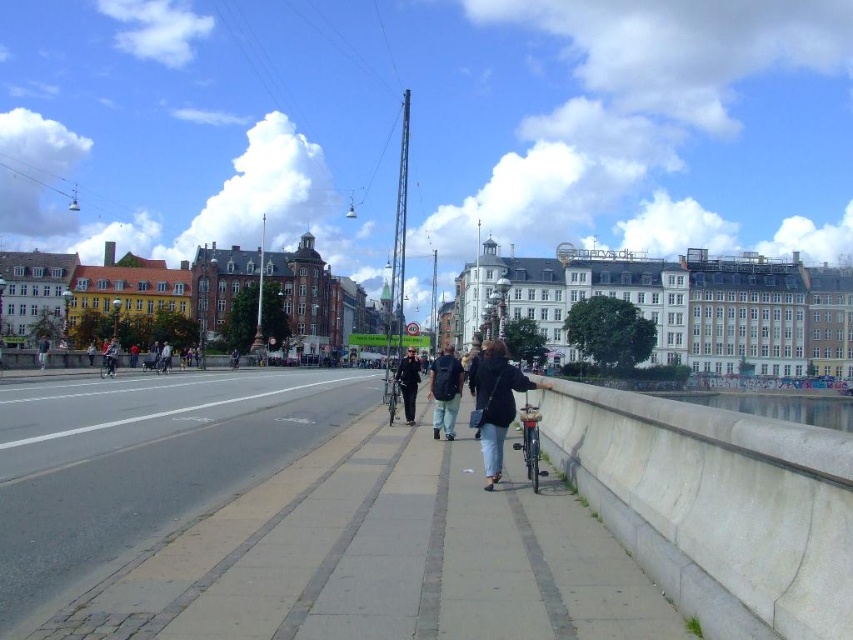
Is dark blue backpack at center below dark blue uniform at center?

Yes.

Which is in front, point (447, 372) or point (415, 362)?

Point (447, 372) is more forward.

Image resolution: width=853 pixels, height=640 pixels. In order to click on dark blue backpack at center in this screenshot , I will do `click(445, 392)`.

Where is `dark blue backpack at center`? dark blue backpack at center is located at coordinates (445, 392).

Is denim jacket at center closer to camera compared to gray concrete waterway at lower right?

Yes, it is in front of gray concrete waterway at lower right.

Is point (479, 365) less distant than point (728, 406)?

Yes, it is.

What do you see at coordinates (496, 404) in the screenshot? I see `denim jacket at center` at bounding box center [496, 404].

The height and width of the screenshot is (640, 853). In order to click on denim jacket at center in this screenshot , I will do `click(496, 404)`.

Is gray concrete pavement at center positioned at the back of denim jacket at center?

No.

Looking at this image, who is shorter, gray concrete pavement at center or denim jacket at center?

gray concrete pavement at center is shorter.

Locate an element on the screen. This screenshot has height=640, width=853. gray concrete pavement at center is located at coordinates (286, 520).